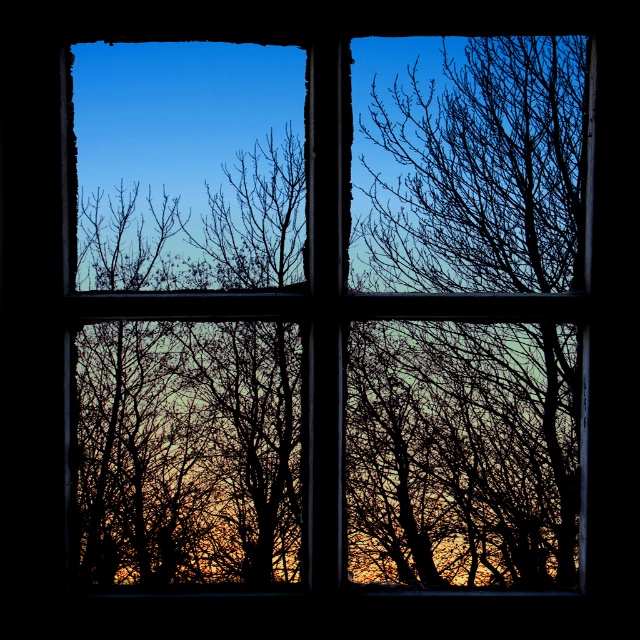
Is transparent glass window at center wider than silhouette bare tree at right?

Indeed, transparent glass window at center has a greater width compared to silhouette bare tree at right.

Between transparent glass window at center and silhouette bare tree at right, which one has less height?

transparent glass window at center

Is point (483, 228) positioned before point (532, 38)?

No, it is not.

Find the location of a particular element. Image resolution: width=640 pixels, height=640 pixels. transparent glass window at center is located at coordinates (461, 452).